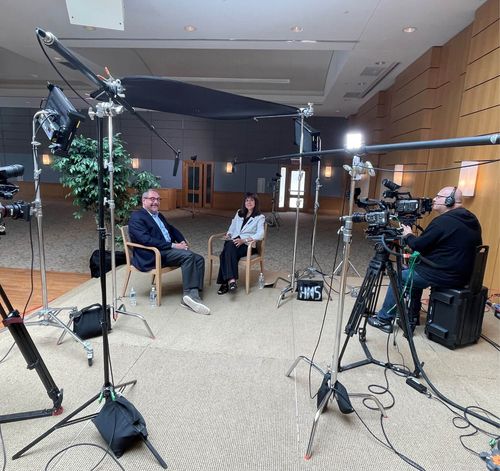
You are a GUI agent. You are given a task and a screenshot of the screen. Output one action in this format:
    pyautogui.click(x=<x>, y=<y>)
    Task: Click on the silver stand legs
    The height and width of the screenshot is (471, 500).
    Given the screenshot: What is the action you would take?
    [x=315, y=417], [x=368, y=397], [x=303, y=356]